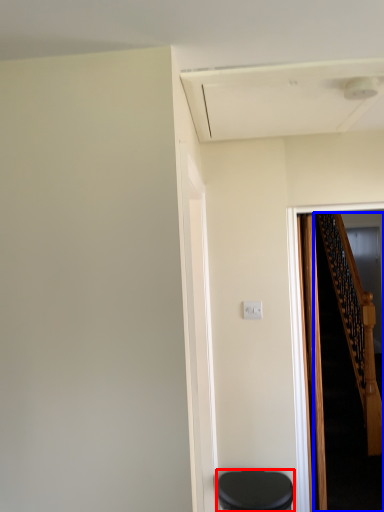
Question: Which object is further to the camera taking this photo, furniture (highlighted by a red box) or stairs (highlighted by a blue box)?

Choices:
 (A) furniture
 (B) stairs

Answer: (B)